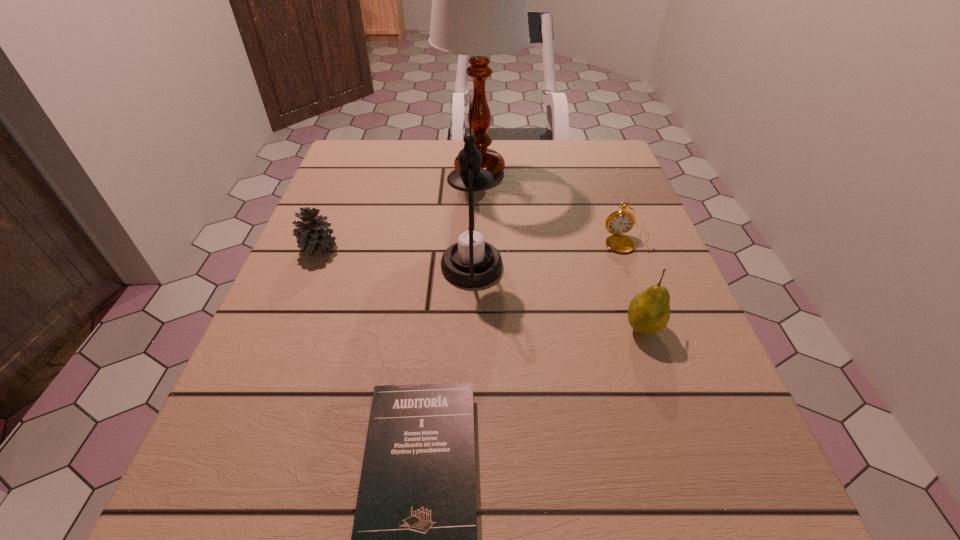
Identify the location of the farthest object. (479, 9).

The image size is (960, 540). In order to click on the tallest object in this screenshot , I will do pyautogui.click(x=479, y=9).

Where is `the second tallest object`? The height and width of the screenshot is (540, 960). the second tallest object is located at coordinates (470, 227).

You are a GUI agent. You are given a task and a screenshot of the screen. Output one action in this format:
    pyautogui.click(x=<x>, y=<y>)
    Task: Click on the pear
    The width and height of the screenshot is (960, 540).
    Given the screenshot: What is the action you would take?
    pyautogui.click(x=648, y=313)

Locate an element on the screen. pinecone is located at coordinates (313, 236).

You are a GUI agent. You are given a task and a screenshot of the screen. Output one action in this format:
    pyautogui.click(x=<x>, y=<y>)
    Task: Click on the pocket watch
    The width and height of the screenshot is (960, 540).
    Given the screenshot: What is the action you would take?
    pyautogui.click(x=619, y=222)

This screenshot has width=960, height=540. I want to click on vacant space located 0.080m on the right of the tallest object, so click(552, 170).

Where is `free space located on the left of the fifth shortest object`? This screenshot has height=540, width=960. free space located on the left of the fifth shortest object is located at coordinates click(348, 266).

What are the coordinates of `free space located 0.180m on the front of the second nearest object` in the screenshot? It's located at (684, 453).

I want to click on vacant area located on the right of the leftmost object, so click(388, 249).